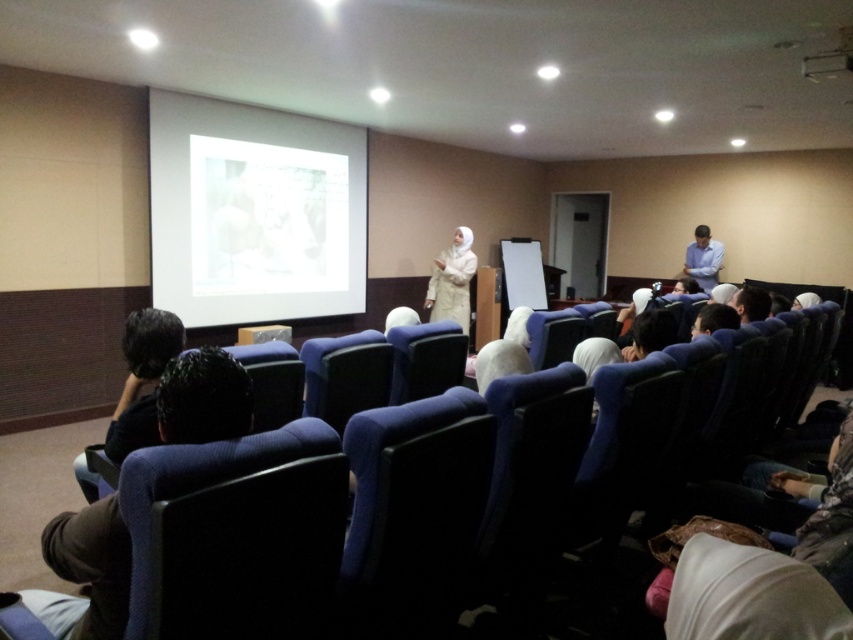
Is point (177, 108) farther from viewer compared to point (106, 538)?

Yes, it is.

Is white matte projection screen at upper center above dark brown fabric at lower left?

Indeed, white matte projection screen at upper center is positioned over dark brown fabric at lower left.

Is point (234, 156) positioned before point (86, 634)?

No, (234, 156) is behind (86, 634).

Identify the location of white matte projection screen at upper center. Image resolution: width=853 pixels, height=640 pixels. (254, 212).

Which is in front, point (49, 552) or point (714, 243)?

Positioned in front is point (49, 552).

Between point (181, 428) and point (709, 284), which one is positioned behind?

The point (709, 284) is more distant.

Does point (231, 358) lie in front of point (718, 262)?

That is True.

Locate an element on the screen. dark brown fabric at lower left is located at coordinates (85, 572).

Is white matte hijab at center closer to the viewer compared to blue shirt at right?

Yes.

Between white matte hijab at center and blue shirt at right, which one appears on the right side from the viewer's perspective?

Positioned to the right is blue shirt at right.

Is point (440, 301) closer to camera compared to point (706, 232)?

That is True.

Identify the location of white matte hijab at center. This screenshot has height=640, width=853. coord(451,280).